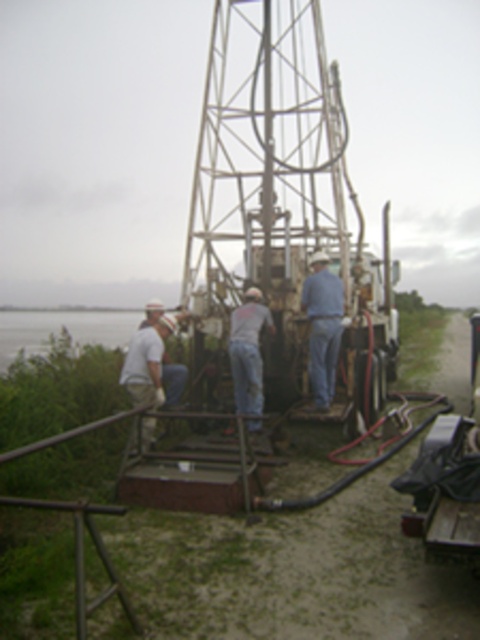
Image resolution: width=480 pixels, height=640 pixels. Find the location of `blue jeans at center`. blue jeans at center is located at coordinates (323, 326).

Who is positioned more to the right, blue jeans at center or white matte shirt at left?

blue jeans at center is more to the right.

Identify the location of blue jeans at center. The width and height of the screenshot is (480, 640). 323,326.

Is gray denim jeans at center closer to camera compared to white matte shirt at left?

No, gray denim jeans at center is behind white matte shirt at left.

Looking at this image, between gray denim jeans at center and white matte shirt at left, which one appears on the right side from the viewer's perspective?

gray denim jeans at center

Is point (251, 381) positioned before point (143, 390)?

That is False.

In order to click on gray denim jeans at center in this screenshot , I will do `click(248, 349)`.

Between blue jeans at center and gray denim jeans at center, which one appears on the right side from the viewer's perspective?

From the viewer's perspective, blue jeans at center appears more on the right side.

Is point (323, 403) farther from camera compared to point (243, 378)?

Yes, point (323, 403) is farther from viewer.

Who is more forward, (312,326) or (247,340)?

Point (247,340) is in front.

Locate an element on the screen. This screenshot has width=480, height=640. blue jeans at center is located at coordinates (323, 326).